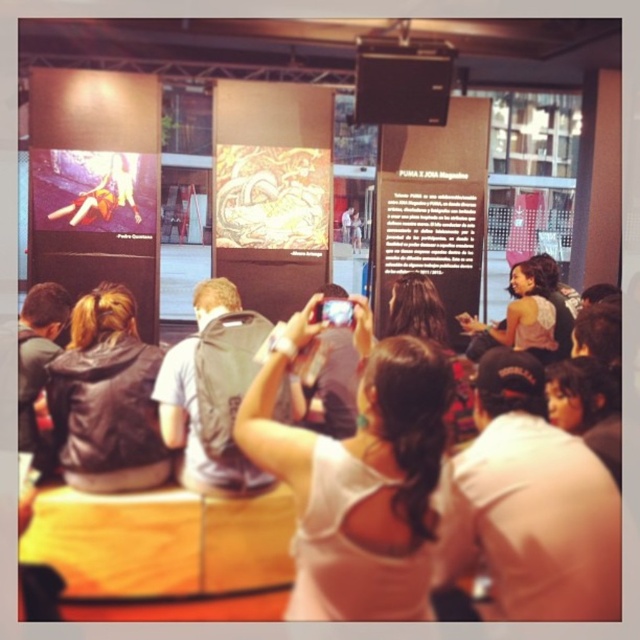
You are at the event and want to take a photo of the white fabric at center without the white fabric crowd at center blocking the view. Which direction should you move to ensure the crowd is out of the frame?

Move to the left side so that the white fabric at center is positioned to the right of the white fabric crowd at center, placing the crowd out of the frame.

You are standing at the entrance of the event and want to take a photo of the white fabric at center. Based on its position coordinates, can you determine if it is located in the upper half or lower half of the image?

The white fabric at center is located at point coordinates of (358,480). Since the y coordinate is 0.561 which is above 0.5, it is in the upper half of the image.